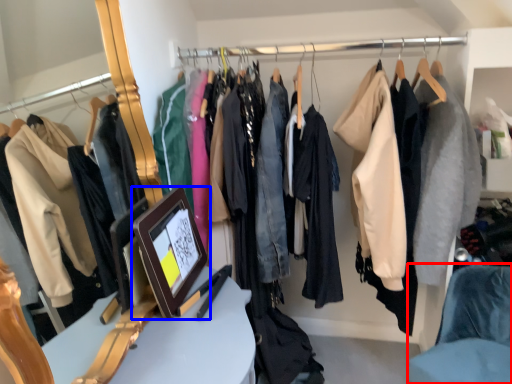
Question: Which of the following is the farthest to the observer, chair (highlighted by a red box) or picture frame (highlighted by a blue box)?

Choices:
 (A) chair
 (B) picture frame

Answer: (A)